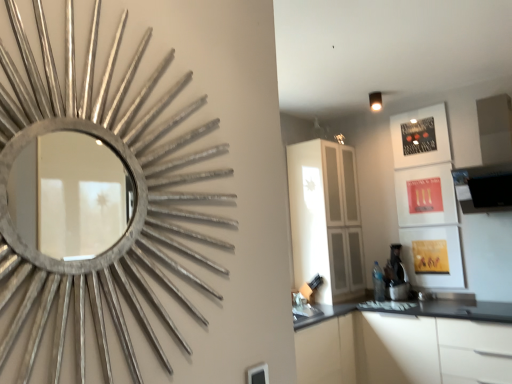
Question: Is black plastic coffee machine at lower right situated inside white matte cabinet at lower right or outside?

Choices:
 (A) inside
 (B) outside

Answer: (B)

Question: In terms of height, does black plastic coffee machine at lower right look taller or shorter compared to white matte cabinet at lower right?

Choices:
 (A) tall
 (B) short

Answer: (B)

Question: Based on their relative distances, which object is farther from the white matte cabinet at lower right?

Choices:
 (A) silver metallic mirror at upper left
 (B) black plastic coffee machine at lower right
 (C) white glossy cabinet at center

Answer: (A)

Question: Which is farther from the white matte cabinet at lower right?

Choices:
 (A) white glossy cabinet at center
 (B) silver metallic mirror at upper left
 (C) black plastic coffee machine at lower right

Answer: (B)